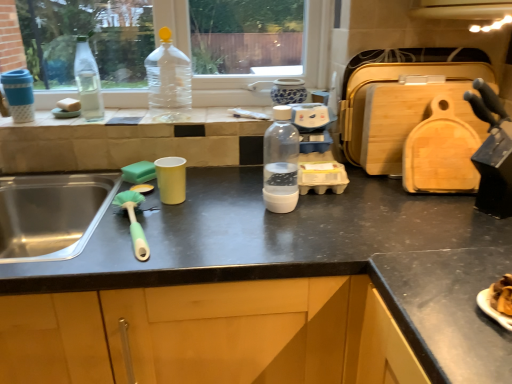
This screenshot has height=384, width=512. I want to click on vacant area situated to the left side of green plastic brush at left, so click(81, 237).